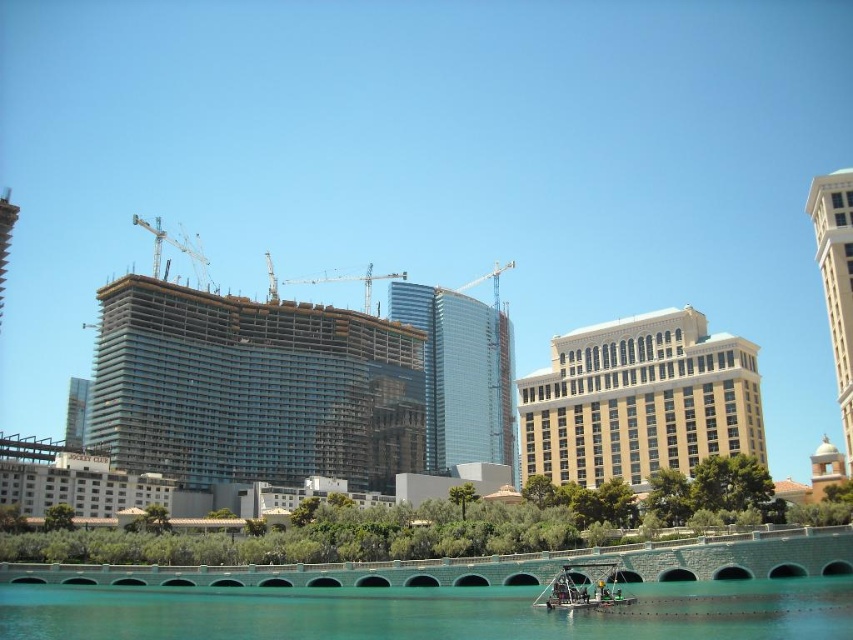
Between point (839, 300) and point (155, 268), which one is positioned in front?

Point (839, 300) is more forward.

Is beige marble tower at upper right below metallic gray crane at upper left?

Yes, beige marble tower at upper right is below metallic gray crane at upper left.

Find the location of a particular element. The image size is (853, 640). beige marble tower at upper right is located at coordinates (836, 278).

Is point (263, 621) positioned in front of point (495, 291)?

Yes, point (263, 621) is closer to viewer.

Does point (772, 605) come closer to viewer compared to point (465, 284)?

Yes, point (772, 605) is closer to viewer.

Where is `teal concrete bridge at lower center`? teal concrete bridge at lower center is located at coordinates (427, 612).

Who is lower down, metallic gray crane at upper left or metallic construction crane at center?

metallic construction crane at center is lower down.

Is metallic gray crane at upper left bigger than metallic construction crane at center?

Correct, metallic gray crane at upper left is larger in size than metallic construction crane at center.

Which is in front, point (165, 241) or point (370, 288)?

Point (370, 288)

Identify the location of metallic gray crane at upper left. The height and width of the screenshot is (640, 853). (175, 248).